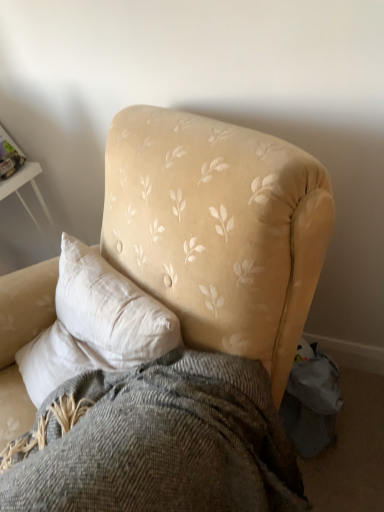
The width and height of the screenshot is (384, 512). What do you see at coordinates (157, 442) in the screenshot?
I see `textured gray blanket at center` at bounding box center [157, 442].

What are the coordinates of `textured gray blanket at center` in the screenshot? It's located at (157, 442).

You are a GUI agent. You are given a task and a screenshot of the screen. Output one action in this format:
    pyautogui.click(x=<x>, y=<y>)
    Task: Click on the velvet yellow armchair at center
    The image size is (384, 512).
    Given the screenshot: What is the action you would take?
    (218, 229)

This screenshot has width=384, height=512. Describe the element at coordinates (218, 229) in the screenshot. I see `velvet yellow armchair at center` at that location.

The height and width of the screenshot is (512, 384). In order to click on textured gray blanket at center in this screenshot , I will do `click(157, 442)`.

Does textured gray blanket at center appear on the right side of velvet yellow armchair at center?

Indeed, textured gray blanket at center is positioned on the right side of velvet yellow armchair at center.

Considering the positions of objects textured gray blanket at center and velvet yellow armchair at center in the image provided, who is in front, textured gray blanket at center or velvet yellow armchair at center?

velvet yellow armchair at center.

Considering the points (143, 441) and (169, 144), which point is behind, point (143, 441) or point (169, 144)?

The point (169, 144) is more distant.

From the image's perspective, which is below, textured gray blanket at center or velvet yellow armchair at center?

textured gray blanket at center.

From a real-world perspective, is textured gray blanket at center located higher than velvet yellow armchair at center?

No, from a real-world perspective, textured gray blanket at center is not over velvet yellow armchair at center

Which of these two, textured gray blanket at center or velvet yellow armchair at center, is wider?

velvet yellow armchair at center is wider.

Which of these two, textured gray blanket at center or velvet yellow armchair at center, stands shorter?

textured gray blanket at center is shorter.

Between textured gray blanket at center and velvet yellow armchair at center, which one has smaller size?

textured gray blanket at center is smaller.

Would you say textured gray blanket at center is outside velvet yellow armchair at center?

No, most part of textured gray blanket at center lies within velvet yellow armchair at center.

Is textured gray blanket at center far away from velvet yellow armchair at center?

No, textured gray blanket at center is not far from velvet yellow armchair at center.

Is textured gray blanket at center oriented towards velvet yellow armchair at center?

Yes, textured gray blanket at center is oriented towards velvet yellow armchair at center.

Can you tell me how much textured gray blanket at center and velvet yellow armchair at center differ in facing direction?

The facing directions of textured gray blanket at center and velvet yellow armchair at center are 1.08 degrees apart.

You are a GUI agent. You are given a task and a screenshot of the screen. Output one action in this format:
    pyautogui.click(x=<x>, y=<y>)
    Task: Click on the chair in front of the textured gray blanket at center
    This screenshot has height=512, width=384.
    Given the screenshot: What is the action you would take?
    pyautogui.click(x=218, y=229)

Visually, is velvet yellow armchair at center positioned to the left or to the right of textured gray blanket at center?

Clearly, velvet yellow armchair at center is on the left of textured gray blanket at center in the image.

Which object is more forward, velvet yellow armchair at center or textured gray blanket at center?

Positioned in front is velvet yellow armchair at center.

Which is in front, point (279, 215) or point (9, 496)?

The point (9, 496) is in front.

From the image's perspective, is velvet yellow armchair at center above textured gray blanket at center?

Yes.

From a real-world perspective, which is physically below, velvet yellow armchair at center or textured gray blanket at center?

textured gray blanket at center, from a real-world perspective.

Based on the photo, in terms of width, does velvet yellow armchair at center look wider or thinner when compared to textured gray blanket at center?

In the image, velvet yellow armchair at center appears to be wider than textured gray blanket at center.

Which of these two, velvet yellow armchair at center or textured gray blanket at center, stands taller?

Standing taller between the two is velvet yellow armchair at center.

Can you confirm if velvet yellow armchair at center is smaller than textured gray blanket at center?

Incorrect, velvet yellow armchair at center is not smaller in size than textured gray blanket at center.

Is velvet yellow armchair at center not within textured gray blanket at center?

velvet yellow armchair at center is positioned outside textured gray blanket at center.

Would you consider velvet yellow armchair at center to be distant from textured gray blanket at center?

No, velvet yellow armchair at center is in close proximity to textured gray blanket at center.

Consider the image. Is velvet yellow armchair at center oriented towards textured gray blanket at center?

Yes, velvet yellow armchair at center is turned towards textured gray blanket at center.

Can you tell me how much velvet yellow armchair at center and textured gray blanket at center differ in facing direction?

There is a 1.08-degree angle between the facing directions of velvet yellow armchair at center and textured gray blanket at center.

Identify the location of chair on the left side of textured gray blanket at center. The height and width of the screenshot is (512, 384). (218, 229).

This screenshot has height=512, width=384. In the image, there is a velvet yellow armchair at center. Find the location of `bedding below it (from a real-world perspective)`. bedding below it (from a real-world perspective) is located at coordinates (157, 442).

You are a GUI agent. You are given a task and a screenshot of the screen. Output one action in this format:
    pyautogui.click(x=<x>, y=<y>)
    Task: Click on the bedding lying on the right of velvet yellow armchair at center
    The width and height of the screenshot is (384, 512).
    Given the screenshot: What is the action you would take?
    pyautogui.click(x=157, y=442)